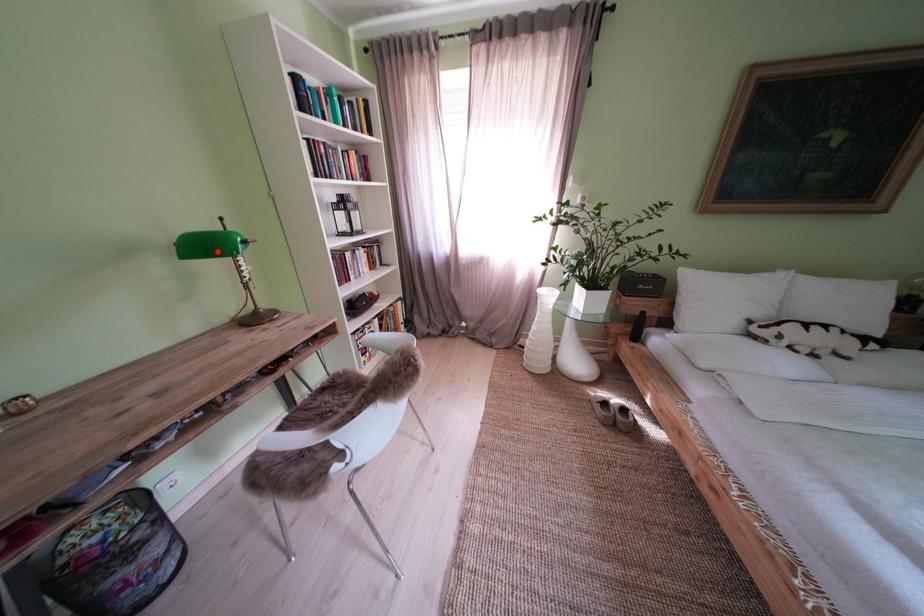
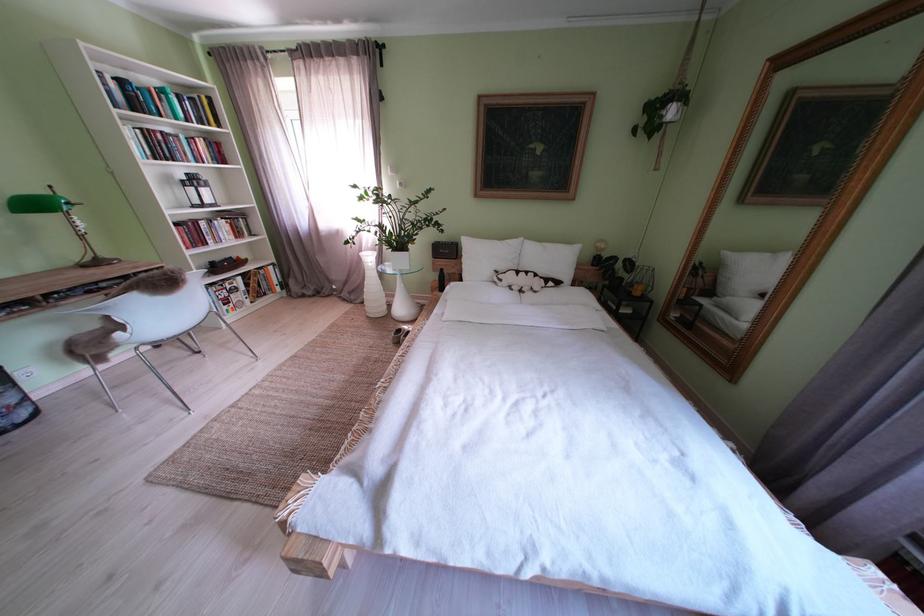
Find the pixel in the second image that matches the highlighted location in the first image.

(46, 209)